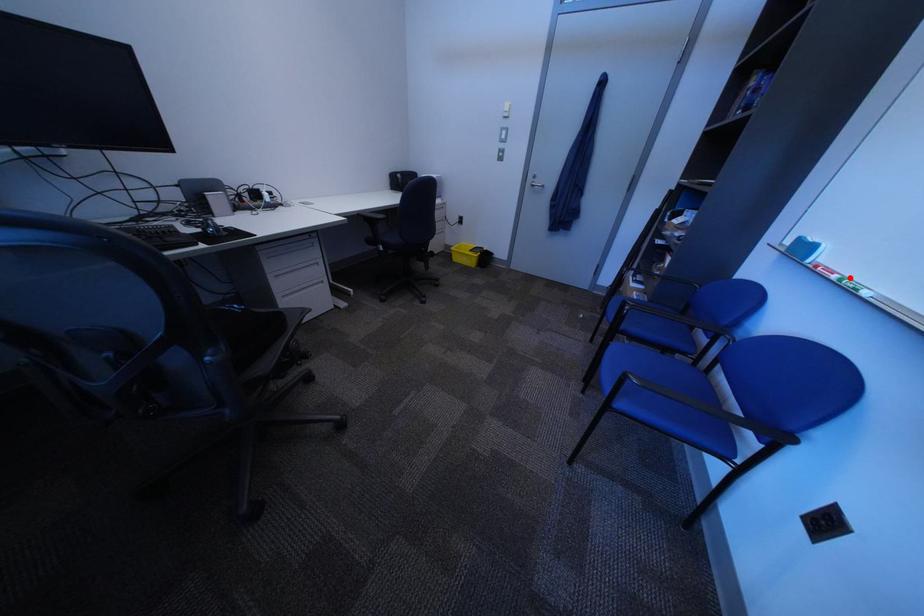
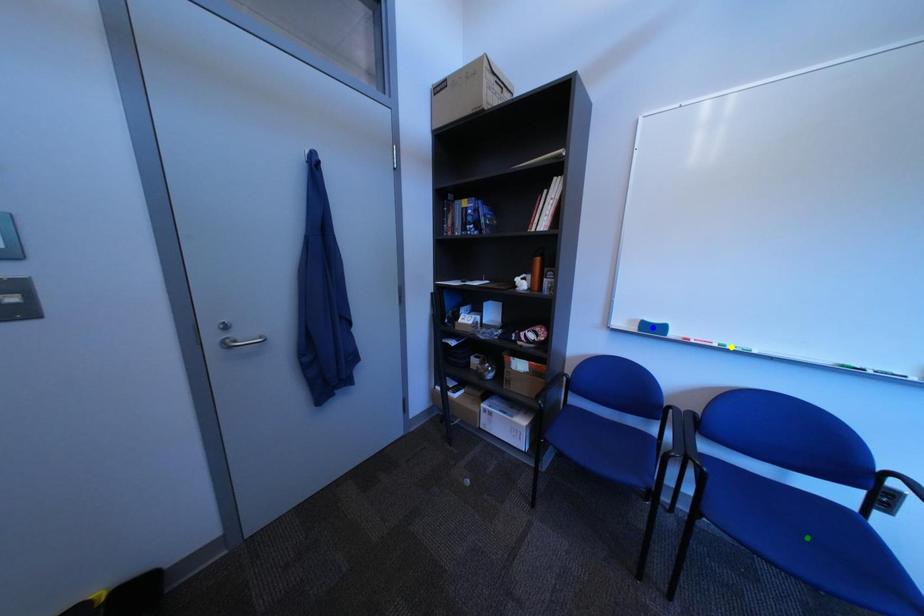
Question: I am providing you with two images of the same scene from different viewpoints. A red point is marked on the first image. You are given multiple points on the second image. Which point in image 2 is actually the same real-world point as the red point in image 1?

Choices:
 (A) blue point
 (B) yellow point
 (C) green point

Answer: (B)